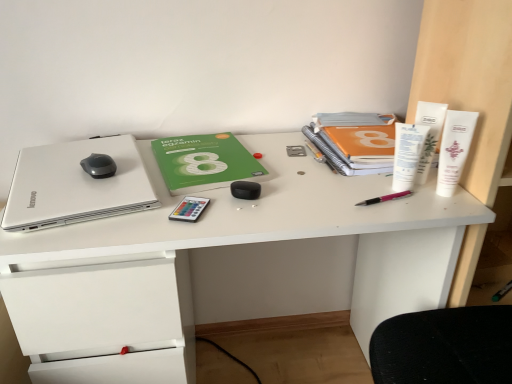
Identify the location of vacant area that is in front of white plastic tubes at right, which is the third stationery from left to right. (412, 209).